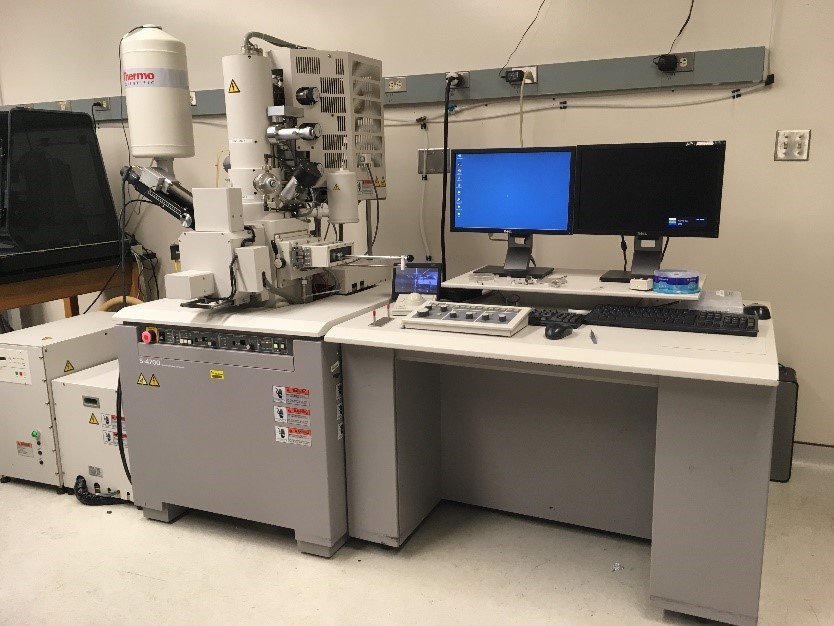
Identify the location of table. (259, 327).